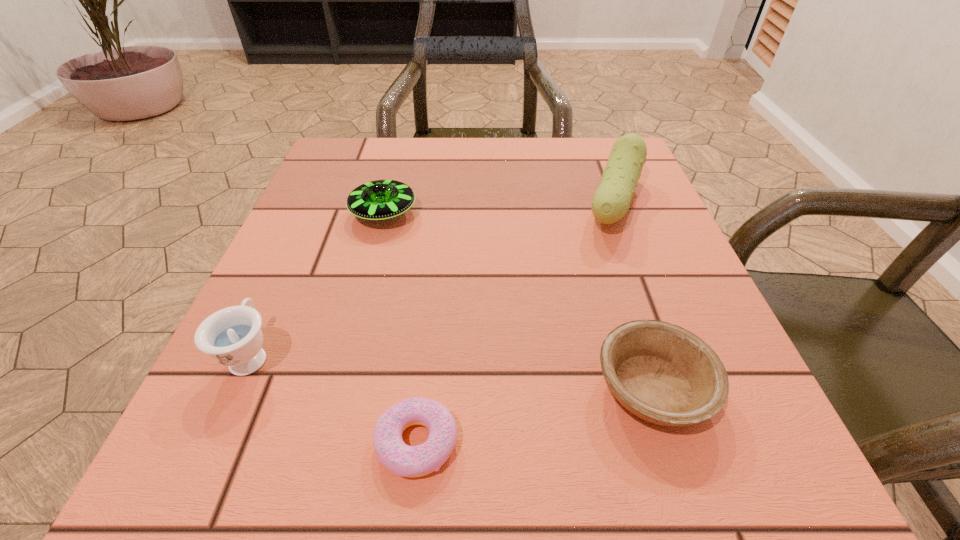
The width and height of the screenshot is (960, 540). What are the coordinates of `empty space that is in between the leftmost object and the cucumber` in the screenshot? It's located at (433, 279).

You are a GUI agent. You are given a task and a screenshot of the screen. Output one action in this format:
    pyautogui.click(x=<x>, y=<y>)
    Task: Click on the empty space that is in between the leftmost object and the cucumber
    Image resolution: width=960 pixels, height=540 pixels.
    Given the screenshot: What is the action you would take?
    tap(433, 279)

Locate an element on the screen. Image resolution: width=960 pixels, height=540 pixels. free space that is in between the teacup and the saucer is located at coordinates (318, 284).

Find the location of a particular element. blank region between the cucumber and the fourth tallest object is located at coordinates [634, 295].

Image resolution: width=960 pixels, height=540 pixels. I want to click on vacant area that lies between the teacup and the cucumber, so click(433, 279).

This screenshot has height=540, width=960. Identify the location of vacant space in between the teacup and the cucumber. (433, 279).

This screenshot has height=540, width=960. Identify the location of vacant area that lies between the shortest object and the second shortest object. (535, 415).

Where is `unoccupied position between the doughnut and the bowl`? The height and width of the screenshot is (540, 960). unoccupied position between the doughnut and the bowl is located at coordinates pos(535,415).

At what (x,y) coordinates should I click in order to perform the action: click on object that stands as the third closest to the saucer. Please return your answer as a coordinate pair (x, y). Looking at the image, I should click on [x=401, y=459].

Select which object appears as the fourth closest to the teacup. Please provide its 2D coordinates. Your answer should be formatted as a tuple, i.e. [(x, y)], where the tuple contains the x and y coordinates of a point satisfying the conditions above.

[(611, 201)]